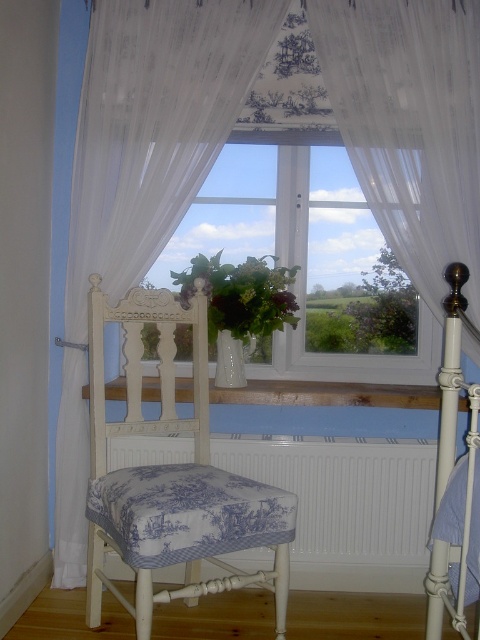
Which is behind, point (184, 467) or point (435, 600)?

Positioned behind is point (184, 467).

Is point (255, 483) positioned in front of point (441, 573)?

No, it is behind (441, 573).

Does point (290, 525) come closer to viewer compared to point (452, 355)?

No, it is not.

The image size is (480, 640). Identify the location of toile fabric stool at lower left. (188, 513).

Is white painted wood chair at center above white textured radiator at lower center?

Correct, white painted wood chair at center is located above white textured radiator at lower center.

The height and width of the screenshot is (640, 480). Identify the location of white painted wood chair at center. click(171, 476).

Between white glass window at center and white textured radiator at lower center, which one is positioned higher?

white glass window at center

Who is positioned more to the right, white glass window at center or white textured radiator at lower center?

white glass window at center is more to the right.

Identify the location of white glass window at center. (300, 256).